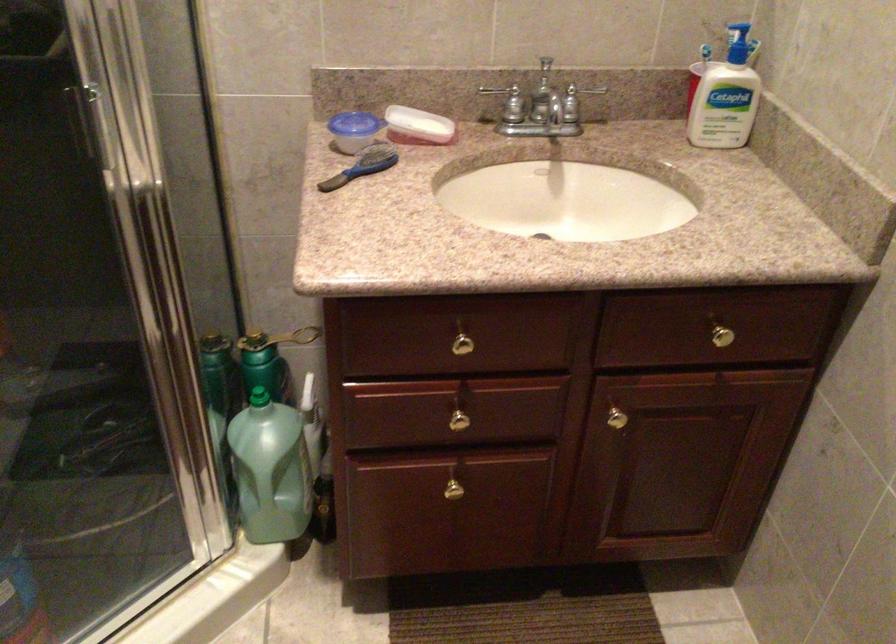
You are a GUI agent. You are given a task and a screenshot of the screen. Output one action in this format:
    pyautogui.click(x=<x>, y=<y>)
    Task: Click on the lotion bottle pump
    This screenshot has height=644, width=896.
    Given the screenshot: What is the action you would take?
    point(739,35)